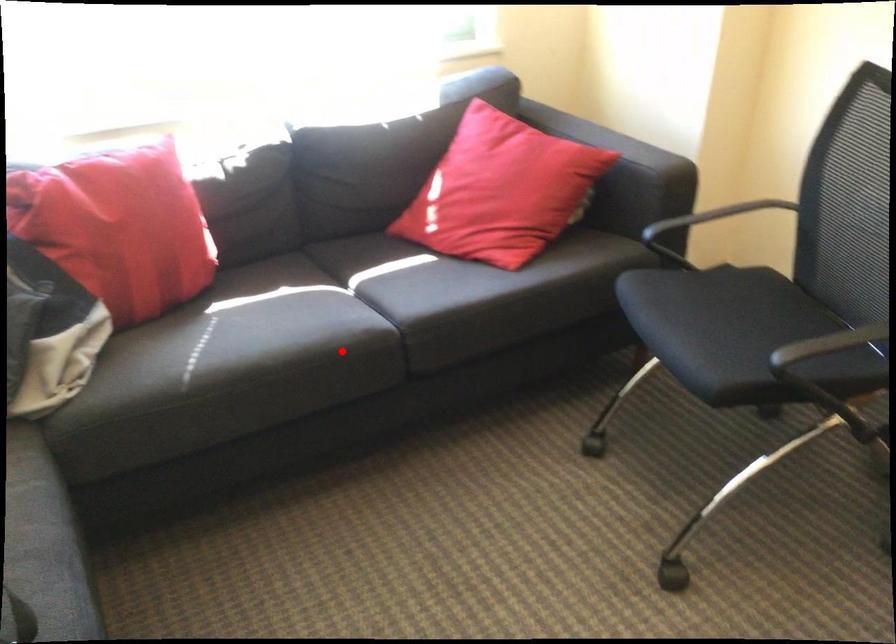
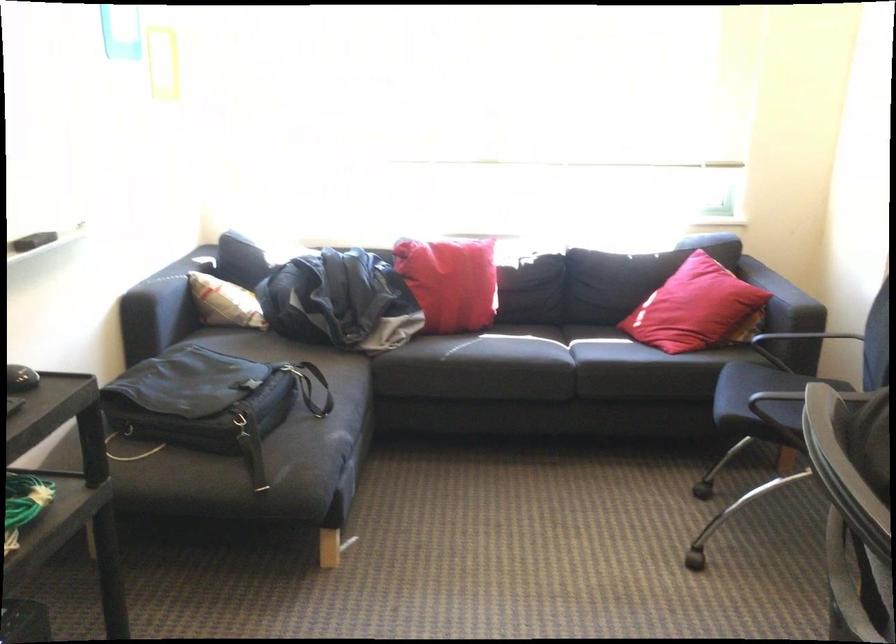
In the second image, find the point that corresponds to the highlighted location in the first image.

(535, 364)